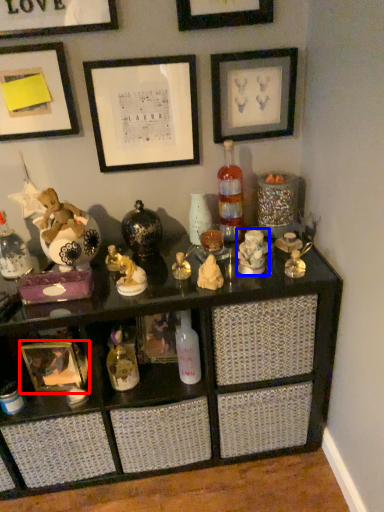
Question: Which point is further to the camera, picture frame (highlighted by a red box) or toy (highlighted by a blue box)?

Choices:
 (A) picture frame
 (B) toy

Answer: (A)